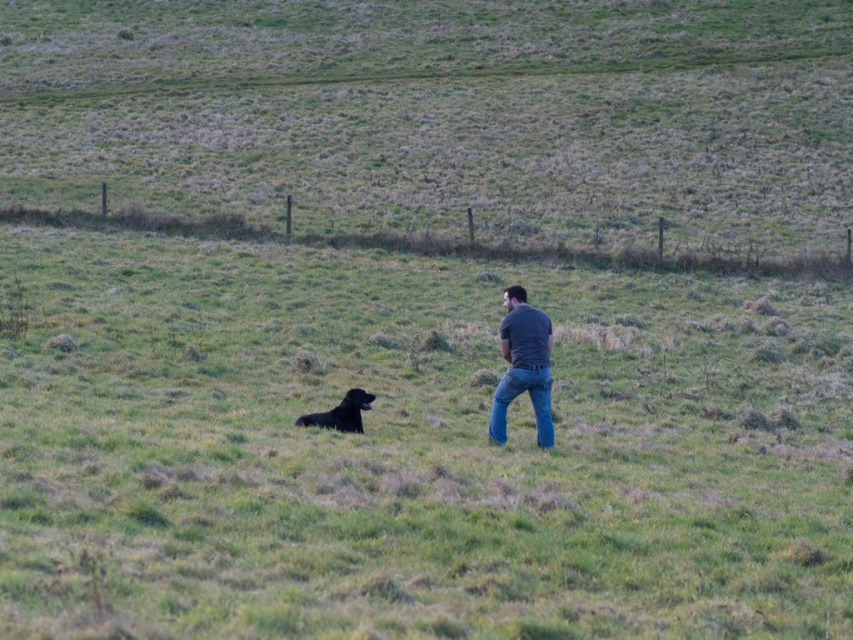
Question: Which object is closer to the camera taking this photo?

Choices:
 (A) shiny black dog at lower center
 (B) dark gray t-shirt at center

Answer: (B)

Question: Can you confirm if dark gray t-shirt at center is positioned below shiny black dog at lower center?

Choices:
 (A) no
 (B) yes

Answer: (A)

Question: Can you confirm if dark gray t-shirt at center is positioned to the left of shiny black dog at lower center?

Choices:
 (A) no
 (B) yes

Answer: (A)

Question: Which point is closer to the camera?

Choices:
 (A) dark gray t-shirt at center
 (B) shiny black dog at lower center

Answer: (A)

Question: Can you confirm if dark gray t-shirt at center is positioned to the left of shiny black dog at lower center?

Choices:
 (A) yes
 (B) no

Answer: (B)